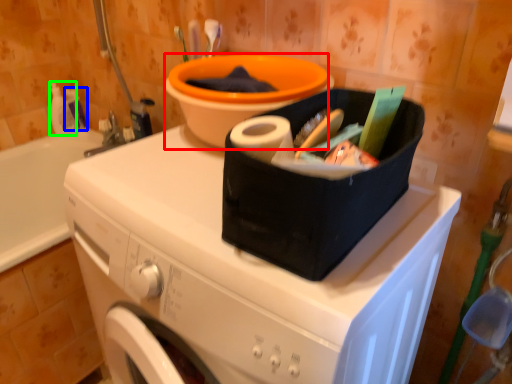
Question: Estimate the real-world distances between objects in this image. Which object is farther from basin (highlighted by a red box), cleaning product (highlighted by a blue box) or cleaning product (highlighted by a green box)?

Choices:
 (A) cleaning product
 (B) cleaning product

Answer: (B)